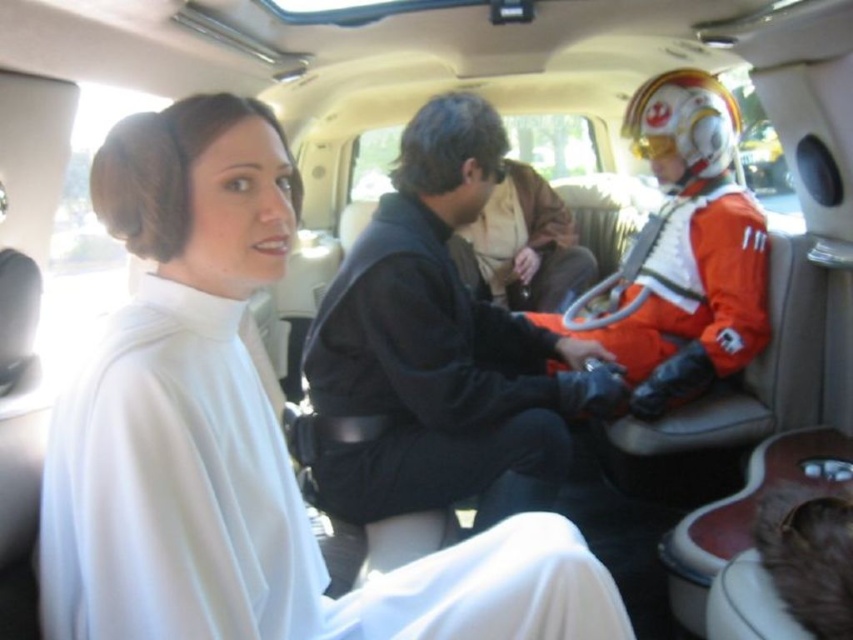
You are a passenger in the car and need to reach the orange fabric helmet at right to adjust it. However, there is a white satin dress at left blocking your path. Can you move the dress to access the helmet?

The white satin dress at left is in front of the orange fabric helmet at right, so you can move the dress to access the helmet.

You are a passenger in the car and need to reach the point marked as point (262, 616). To do so, you must first pass through point (360, 445). Is this path possible?

Yes, because point (262, 616) is in front of point (360, 445), so you can move from the latter to the former along the path.

You are sitting in the backseat of a car and notice two items in the front seat. There is a black leather jacket at center and an orange fabric helmet at right. Which item would appear larger to you?

The black leather jacket at center appears larger because it is closer to the viewer than the orange fabric helmet at right.